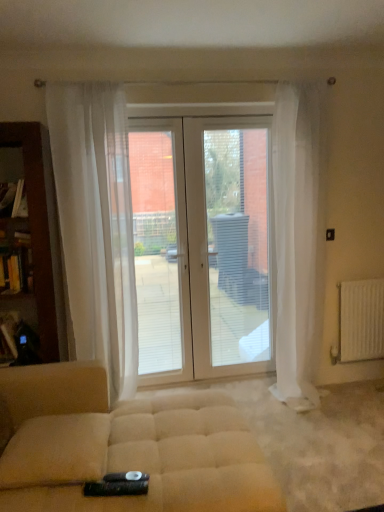
At what (x,y) coordinates should I click in order to perform the action: click on space that is in front of white sheer curtain at right, which ranks as the 1th curtain in right-to-left order. Please return your answer as a coordinate pair (x, y). The height and width of the screenshot is (512, 384). Looking at the image, I should click on (321, 425).